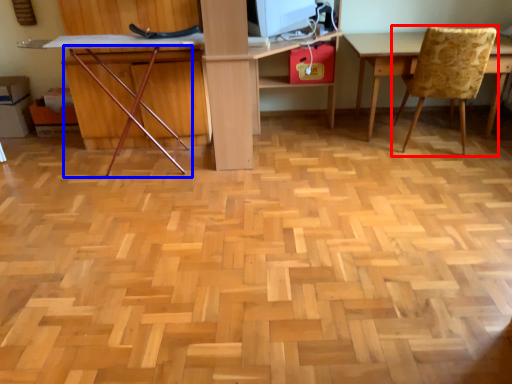
Question: Which object is further to the camera taking this photo, chair (highlighted by a red box) or chair (highlighted by a blue box)?

Choices:
 (A) chair
 (B) chair

Answer: (A)